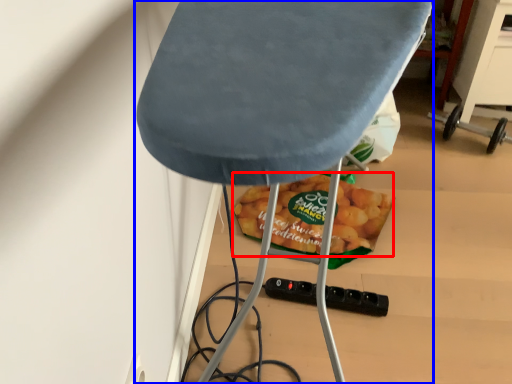
Question: Among these objects, which one is farthest to the camera, snack (highlighted by a red box) or furniture (highlighted by a blue box)?

Choices:
 (A) snack
 (B) furniture

Answer: (A)